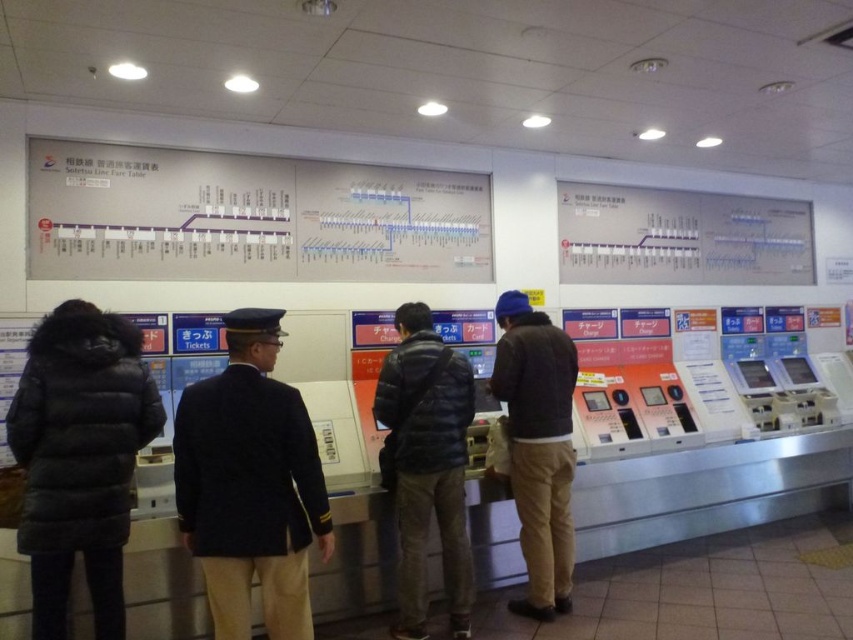
Question: Is dark blue uniform at center to the left of black fur-trimmed coat at left from the viewer's perspective?

Choices:
 (A) no
 (B) yes

Answer: (A)

Question: Which of these objects is positioned closest to the dark blue uniform at center?

Choices:
 (A) dark blue puffer jacket at center
 (B) black fur-trimmed coat at left

Answer: (B)

Question: Among these points, which one is farthest from the camera?

Choices:
 (A) (560, 410)
 (B) (90, 563)
 (C) (257, 413)
 (D) (445, 369)

Answer: (A)

Question: Is the position of dark blue uniform at center less distant than that of black fur-trimmed coat at left?

Choices:
 (A) yes
 (B) no

Answer: (A)

Question: Does dark blue uniform at center have a greater width compared to dark gray sweater at center?

Choices:
 (A) yes
 (B) no

Answer: (A)

Question: Which point appears farthest from the camera in this image?

Choices:
 (A) (550, 474)
 (B) (421, 628)
 (C) (61, 467)

Answer: (A)